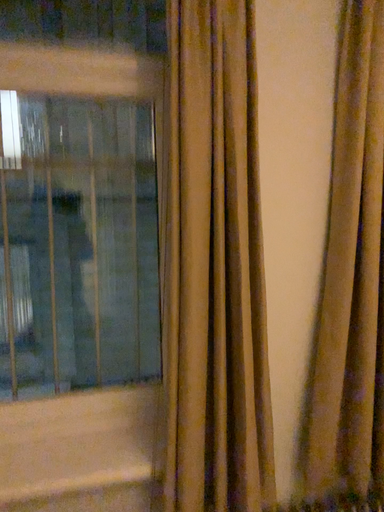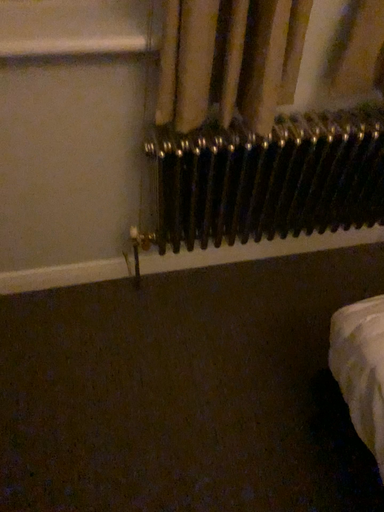
Question: How did the camera likely rotate when shooting the video?

Choices:
 (A) rotated upward
 (B) rotated downward

Answer: (B)